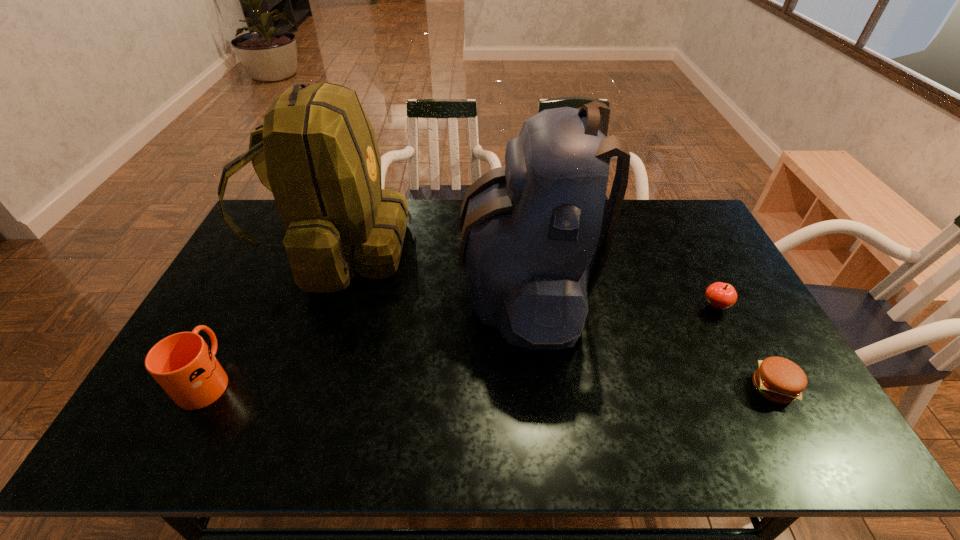
You are a GUI agent. You are given a task and a screenshot of the screen. Output one action in this format:
    pyautogui.click(x=<x>, y=<y>)
    Task: Click on the third object from left to right
    
    Given the screenshot: What is the action you would take?
    pyautogui.click(x=529, y=229)

At what (x,y) coordinates should I click in order to perform the action: click on the left backpack. Please return your answer as a coordinate pair (x, y). Looking at the image, I should click on pos(316,151).

Locate an element on the screen. This screenshot has width=960, height=540. the third shortest object is located at coordinates (183, 365).

Find the location of a particular element. the second shortest object is located at coordinates coord(719,295).

Locate an element on the screen. This screenshot has width=960, height=540. hamburger is located at coordinates (778, 379).

Where is `vacant space located 0.050m at the front pocket of the third object from right to left`? This screenshot has width=960, height=540. vacant space located 0.050m at the front pocket of the third object from right to left is located at coordinates (445, 287).

Identify the location of free region located at the front pocket of the third object from right to left. (400, 287).

Locate an element on the screen. free region located 0.050m at the front pocket of the third object from right to left is located at coordinates (445, 287).

Identify the location of free region located on the front-facing side of the left backpack. The height and width of the screenshot is (540, 960). (502, 249).

Locate an element on the screen. Image resolution: width=960 pixels, height=540 pixels. blank area located on the handle side of the third shortest object is located at coordinates (252, 293).